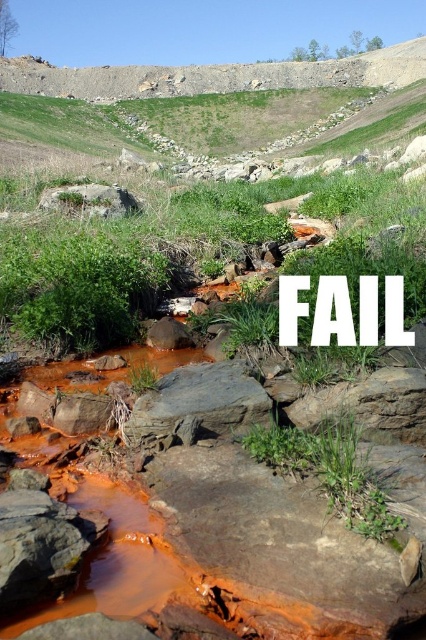
You are a hiker who wants to cross the stream. You see the rusty rock cliff at upper center and the rusty rock at center. Which rock can you step on to cross the stream?

The rusty rock at center can be stepped on to cross the stream because it is smaller and more accessible compared to the bigger rusty rock cliff at upper center.

You are a hiker trying to cross the stream using the rocks. The rusty rock cliff at upper center and the rusty rock at center are both in your path. Which rock is wider and would provide a more stable footing?

The rusty rock cliff at upper center is wider than the rusty rock at center, so it would provide a more stable footing.